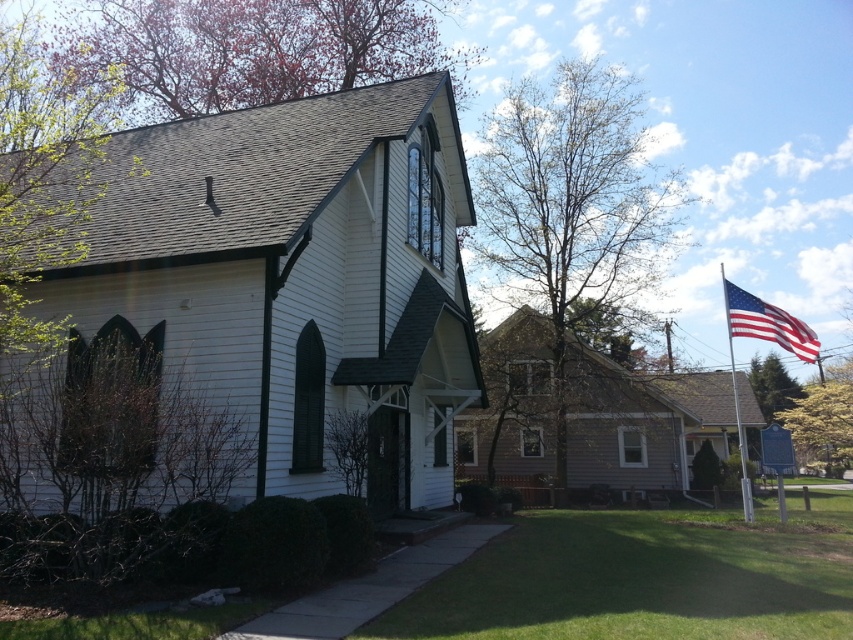
Is american flag at upper right above silver metallic flag pole at right?

Yes, american flag at upper right is above silver metallic flag pole at right.

Does american flag at upper right appear under silver metallic flag pole at right?

No.

I want to click on american flag at upper right, so click(767, 323).

Between white wood chapel at center and american flag at upper right, which one has less height?

With less height is american flag at upper right.

Find the location of a particular element. Image resolution: width=853 pixels, height=640 pixels. white wood chapel at center is located at coordinates (296, 278).

Can you confirm if white wood chapel at center is bigger than silver metallic flag pole at right?

Incorrect, white wood chapel at center is not larger than silver metallic flag pole at right.

Who is higher up, white wood chapel at center or silver metallic flag pole at right?

white wood chapel at center

Find the location of a particular element. Image resolution: width=853 pixels, height=640 pixels. white wood chapel at center is located at coordinates (296, 278).

Locate an element on the screen. Image resolution: width=853 pixels, height=640 pixels. white wood chapel at center is located at coordinates (296, 278).